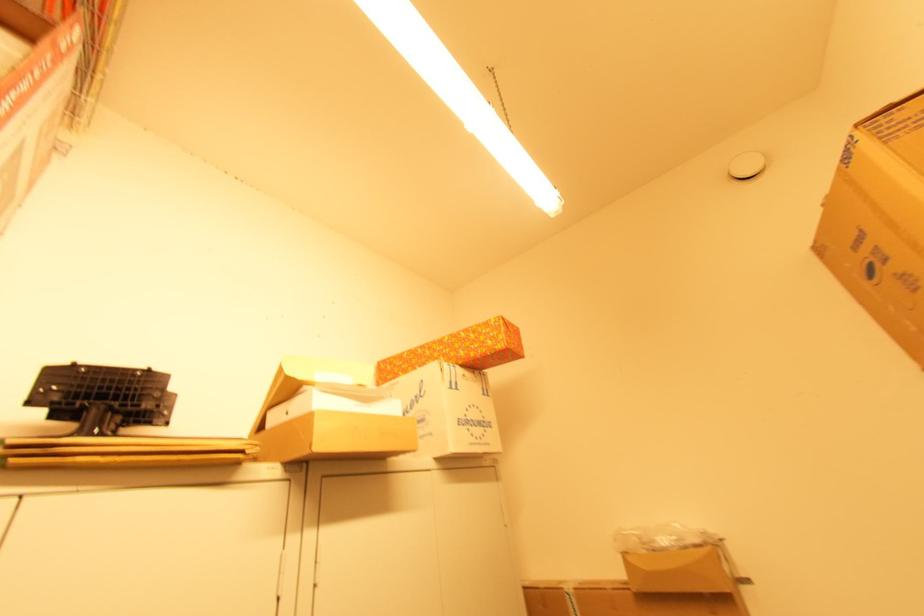
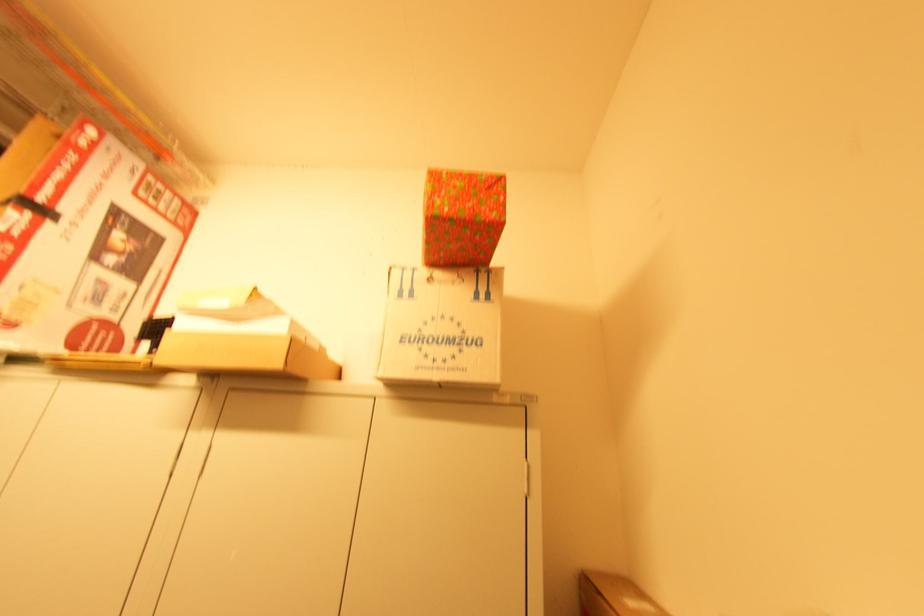
Find the pixel in the second image that matches the point at 466,416 in the first image.

(418, 333)